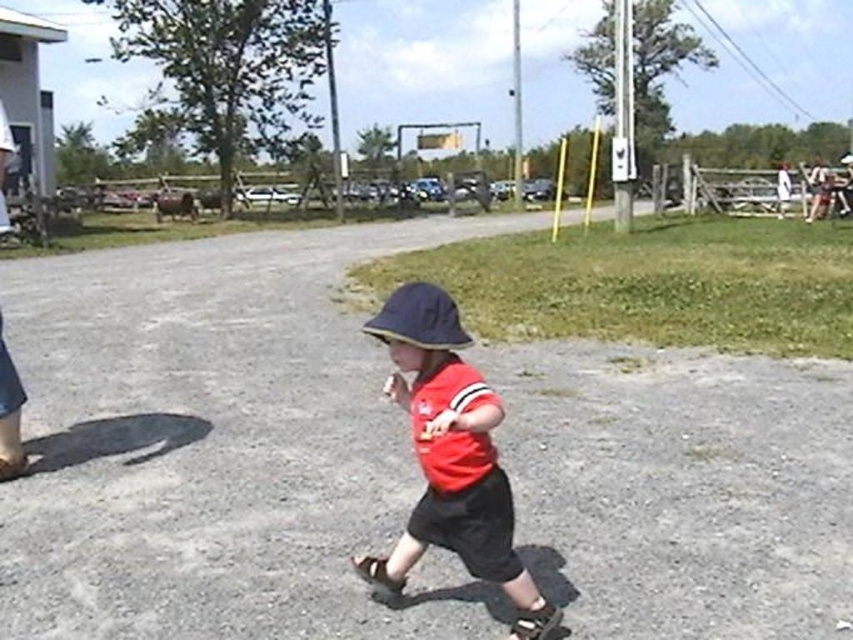
Question: Estimate the real-world distances between objects in this image. Which object is farther from the gray gravel road at center?

Choices:
 (A) navy blue fabric baseball hat at center
 (B) red matte hat at center

Answer: (A)

Question: Can you confirm if red matte hat at center is thinner than navy blue fabric baseball hat at center?

Choices:
 (A) yes
 (B) no

Answer: (B)

Question: Among these objects, which one is nearest to the camera?

Choices:
 (A) red matte hat at center
 (B) gray gravel road at center

Answer: (A)

Question: Can you confirm if gray gravel road at center is positioned above navy blue fabric baseball hat at center?

Choices:
 (A) no
 (B) yes

Answer: (A)

Question: Considering the relative positions of gray gravel road at center and navy blue fabric baseball hat at center in the image provided, where is gray gravel road at center located with respect to navy blue fabric baseball hat at center?

Choices:
 (A) right
 (B) left

Answer: (B)

Question: Among these objects, which one is farthest from the camera?

Choices:
 (A) gray gravel road at center
 (B) red matte hat at center

Answer: (A)